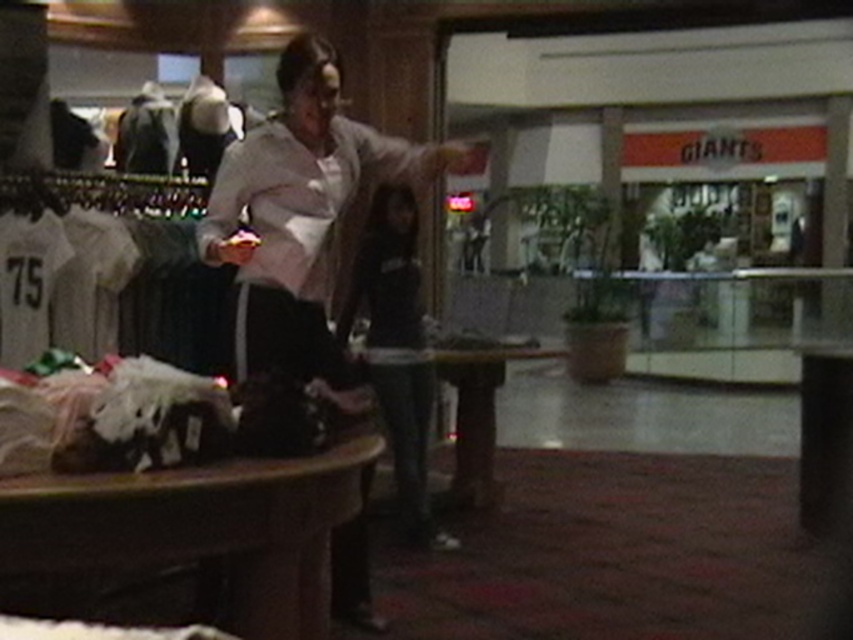
In the scene shown: Does light pink fabric shirt at center come behind black matte jacket at center?

That is False.

Does light pink fabric shirt at center have a larger size compared to black matte jacket at center?

Actually, light pink fabric shirt at center might be smaller than black matte jacket at center.

Who is more distant from viewer, (340, 189) or (387, 378)?

Positioned behind is point (387, 378).

Where is `light pink fabric shirt at center`? Image resolution: width=853 pixels, height=640 pixels. light pink fabric shirt at center is located at coordinates (300, 214).